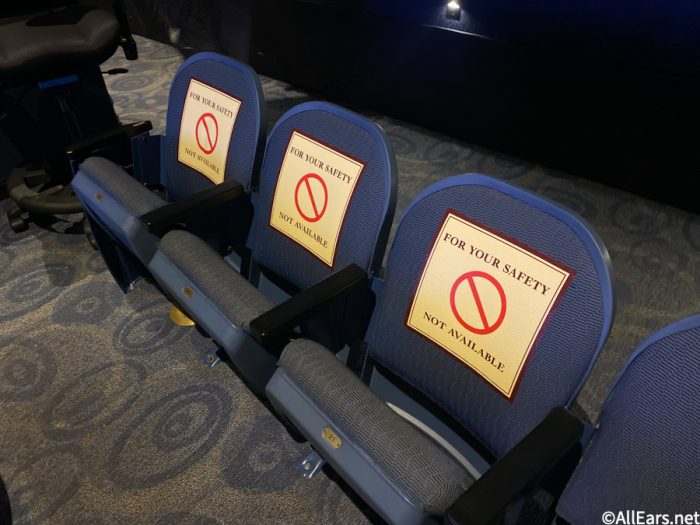
You are a GUI agent. You are given a task and a screenshot of the screen. Output one action in this format:
    pyautogui.click(x=<x>, y=<y>)
    Task: Click on the carpet
    This screenshot has height=525, width=700.
    Given the screenshot: What is the action you would take?
    pyautogui.click(x=75, y=304)